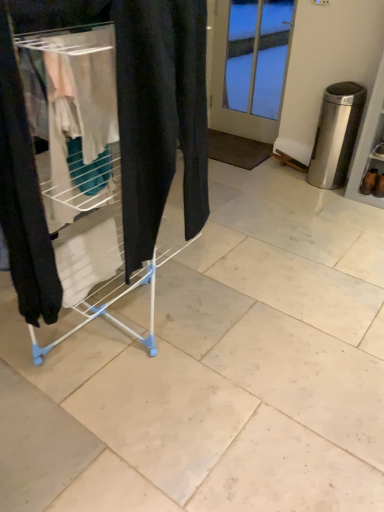
Where is `vacant area that lies between white plastic drying rack at left and brown suede boot at lower right, the 1th footwear viewed from the right`? Image resolution: width=384 pixels, height=512 pixels. vacant area that lies between white plastic drying rack at left and brown suede boot at lower right, the 1th footwear viewed from the right is located at coordinates (269, 252).